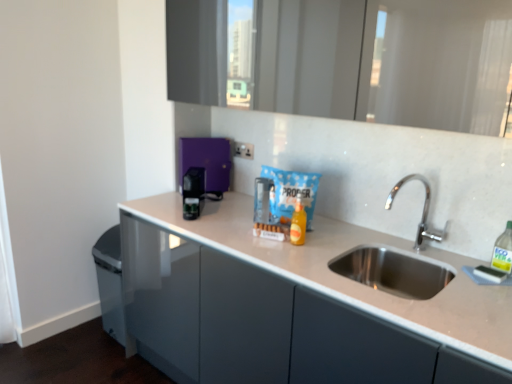
Question: Is green translucent bottle at right, which is the 2th bottle in back-to-front order, positioned with its back to black plastic coffee machine at center, acting as the 2th appliance starting from the back?

Choices:
 (A) no
 (B) yes

Answer: (A)

Question: Is green translucent bottle at right, which is the first bottle from front to back, directly adjacent to black plastic coffee machine at center, the 1th appliance in the front-to-back sequence?

Choices:
 (A) yes
 (B) no

Answer: (B)

Question: Could you tell me if green translucent bottle at right, which is the 2th bottle in left-to-right order, is facing black plastic coffee machine at center, the 1th appliance in the front-to-back sequence?

Choices:
 (A) yes
 (B) no

Answer: (B)

Question: From a real-world perspective, does green translucent bottle at right, which is the 2th bottle in left-to-right order, stand above black plastic coffee machine at center, acting as the 2th appliance starting from the back?

Choices:
 (A) no
 (B) yes

Answer: (B)

Question: Is green translucent bottle at right, which is the 2th bottle in back-to-front order, to the right of black plastic coffee machine at center, acting as the 2th appliance starting from the back, from the viewer's perspective?

Choices:
 (A) yes
 (B) no

Answer: (A)

Question: Relative to white plastic electric outlet at center, is white glossy countertop at center in front or behind?

Choices:
 (A) behind
 (B) front

Answer: (B)

Question: In terms of size, does white glossy countertop at center appear bigger or smaller than white plastic electric outlet at center?

Choices:
 (A) big
 (B) small

Answer: (A)

Question: From a real-world perspective, is white glossy countertop at center positioned above or below white plastic electric outlet at center?

Choices:
 (A) below
 (B) above

Answer: (A)

Question: From their relative heights in the image, would you say white glossy countertop at center is taller or shorter than white plastic electric outlet at center?

Choices:
 (A) tall
 (B) short

Answer: (A)

Question: From the image's perspective, is purple glossy coffee machine at center, the second appliance from the front, positioned above or below black plastic coffee machine at center, acting as the 2th appliance starting from the back?

Choices:
 (A) above
 (B) below

Answer: (A)

Question: Is purple glossy coffee machine at center, which appears as the first appliance when viewed from the back, bigger or smaller than black plastic coffee machine at center, the 1th appliance in the front-to-back sequence?

Choices:
 (A) big
 (B) small

Answer: (A)

Question: From a real-world perspective, is purple glossy coffee machine at center, which appears as the first appliance when viewed from the back, positioned above or below black plastic coffee machine at center, acting as the 2th appliance starting from the back?

Choices:
 (A) above
 (B) below

Answer: (A)

Question: Is purple glossy coffee machine at center, which appears as the first appliance when viewed from the back, in front of or behind black plastic coffee machine at center, acting as the 2th appliance starting from the back, in the image?

Choices:
 (A) behind
 (B) front

Answer: (A)

Question: From the image's perspective, relative to purple glossy coffee machine at center, the second appliance from the front, is green translucent bottle at right, which is the 2th bottle in back-to-front order, above or below?

Choices:
 (A) above
 (B) below

Answer: (B)

Question: In the image, is green translucent bottle at right, which is the 2th bottle in left-to-right order, positioned in front of or behind purple glossy coffee machine at center, which appears as the first appliance when viewed from the back?

Choices:
 (A) front
 (B) behind

Answer: (A)